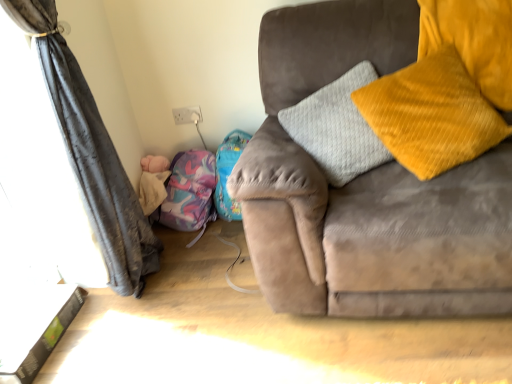
Question: Is purple fabric bean bag chair at lower left not inside soft pink plush at lower left?

Choices:
 (A) yes
 (B) no

Answer: (A)

Question: Could soft pink plush at lower left be considered to be inside purple fabric bean bag chair at lower left?

Choices:
 (A) yes
 (B) no

Answer: (B)

Question: Is purple fabric bean bag chair at lower left oriented away from soft pink plush at lower left?

Choices:
 (A) no
 (B) yes

Answer: (A)

Question: Is purple fabric bean bag chair at lower left at the right side of soft pink plush at lower left?

Choices:
 (A) yes
 (B) no

Answer: (A)

Question: Is purple fabric bean bag chair at lower left facing towards soft pink plush at lower left?

Choices:
 (A) no
 (B) yes

Answer: (A)

Question: Can you confirm if purple fabric bean bag chair at lower left is bigger than soft pink plush at lower left?

Choices:
 (A) yes
 (B) no

Answer: (A)

Question: Considering the relative sizes of velvet yellow pillow at right and white glossy table at lower left in the image provided, is velvet yellow pillow at right smaller than white glossy table at lower left?

Choices:
 (A) yes
 (B) no

Answer: (B)

Question: From the image's perspective, is velvet yellow pillow at right located beneath white glossy table at lower left?

Choices:
 (A) no
 (B) yes

Answer: (A)

Question: Does velvet yellow pillow at right turn towards white glossy table at lower left?

Choices:
 (A) yes
 (B) no

Answer: (B)

Question: Is velvet yellow pillow at right far away from white glossy table at lower left?

Choices:
 (A) no
 (B) yes

Answer: (B)

Question: Can you confirm if velvet yellow pillow at right is taller than white glossy table at lower left?

Choices:
 (A) no
 (B) yes

Answer: (B)

Question: From a real-world perspective, is velvet yellow pillow at right below white glossy table at lower left?

Choices:
 (A) yes
 (B) no

Answer: (B)

Question: Considering the relative sizes of purple fabric bean bag chair at lower left and dark grey fabric curtain at left in the image provided, is purple fabric bean bag chair at lower left smaller than dark grey fabric curtain at left?

Choices:
 (A) no
 (B) yes

Answer: (B)